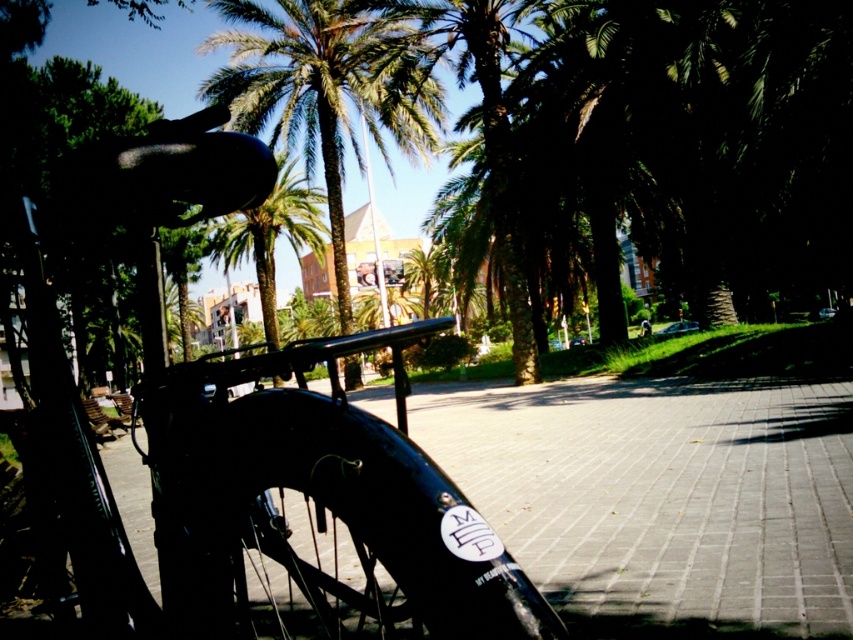
Is point (247, 380) closer to viewer compared to point (793, 248)?

That is True.

Can you confirm if shiny black bicycle at center is smaller than green leafy tree at center?

Yes.

Where is `shiny black bicycle at center`? shiny black bicycle at center is located at coordinates (259, 500).

Measure the distance between point (274, 100) and camera.

Point (274, 100) is 25.49 meters from camera.

Who is more distant from viewer, (364, 49) or (236, 220)?

The point (236, 220) is more distant.

Locate an element on the screen. green leafy palm tree at center is located at coordinates (325, 88).

Who is positioned more to the left, green leafy tree at center or green leafy palm tree at upper center?

green leafy palm tree at upper center

Find the location of a particular element. green leafy tree at center is located at coordinates (656, 134).